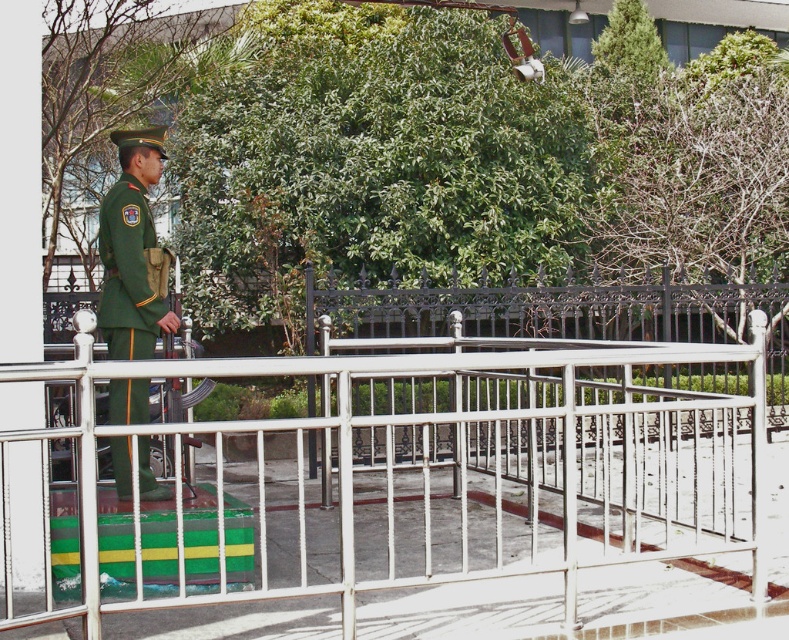
Question: Does white metal rail at center have a greater width compared to green matte uniform at left?

Choices:
 (A) no
 (B) yes

Answer: (B)

Question: Which point is closer to the camera taking this photo?

Choices:
 (A) (352, 499)
 (B) (131, 216)

Answer: (B)

Question: Does white metal rail at center have a larger size compared to green matte uniform at left?

Choices:
 (A) yes
 (B) no

Answer: (B)

Question: Which object is farther from the camera taking this photo?

Choices:
 (A) green matte uniform at left
 (B) white metal rail at center

Answer: (A)

Question: Does white metal rail at center have a lesser width compared to green matte uniform at left?

Choices:
 (A) no
 (B) yes

Answer: (A)